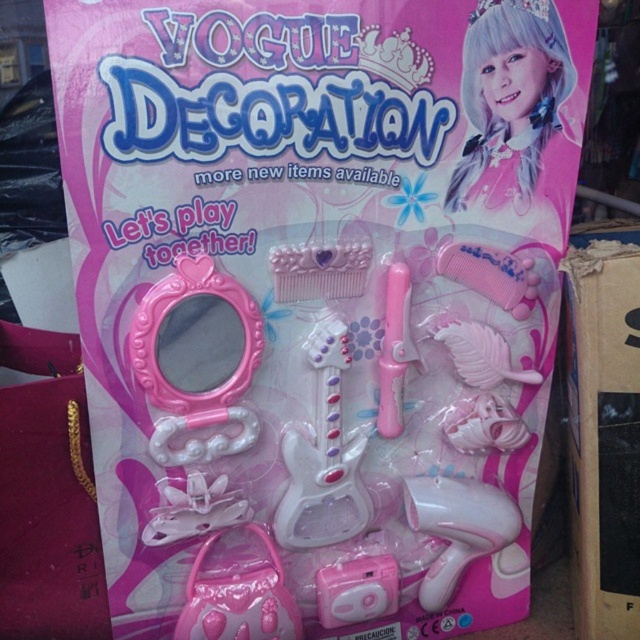
Question: Does white matte doll at upper right appear on the left side of pink plastic hair clip at lower center?

Choices:
 (A) yes
 (B) no

Answer: (B)

Question: Among these objects, which one is farthest from the camera?

Choices:
 (A) white matte doll at upper right
 (B) pink plastic hairdryer at center
 (C) pink plastic camera at center
 (D) pink plastic comb at center-right

Answer: (B)

Question: Is pink plastic hairdryer at center closer to the viewer compared to pink plastic camera at center?

Choices:
 (A) yes
 (B) no

Answer: (B)

Question: Which point is farther to the camera?

Choices:
 (A) pink plastic mirror at center
 (B) pink plastic hairdryer at center

Answer: (B)

Question: Considering the relative positions of pink plastic comb at center-right and pink plastic comb at upper center in the image provided, where is pink plastic comb at center-right located with respect to pink plastic comb at upper center?

Choices:
 (A) left
 (B) right

Answer: (A)

Question: Among these points, which one is nearest to the camera?

Choices:
 (A) (532, 10)
 (B) (260, 545)

Answer: (A)